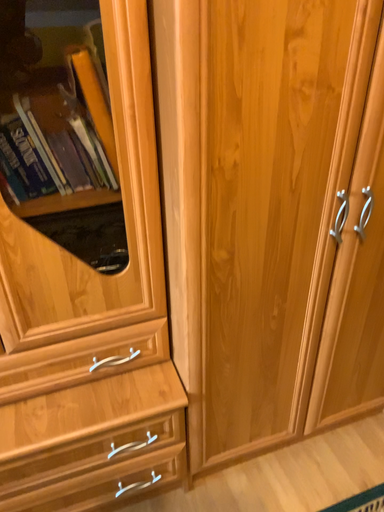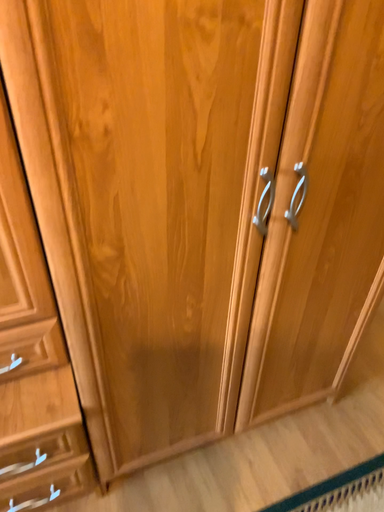
Question: Which way did the camera rotate in the video?

Choices:
 (A) rotated downward
 (B) rotated upward

Answer: (A)